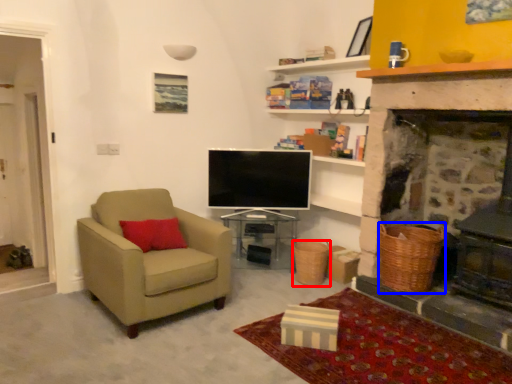
Question: Which object appears closest to the camera in this image, basket (highlighted by a red box) or basket (highlighted by a blue box)?

Choices:
 (A) basket
 (B) basket

Answer: (B)